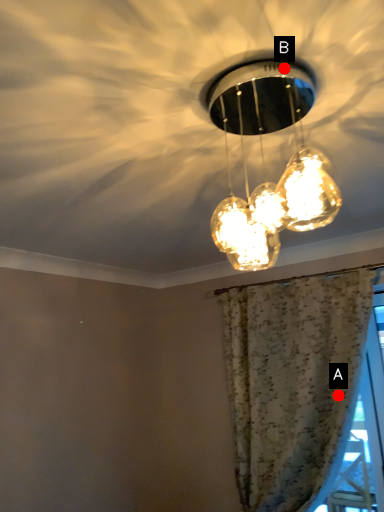
Question: Two points are circled on the image, labeled by A and B beside each circle. Which point appears farthest from the camera in this image?

Choices:
 (A) A is further
 (B) B is further

Answer: (A)